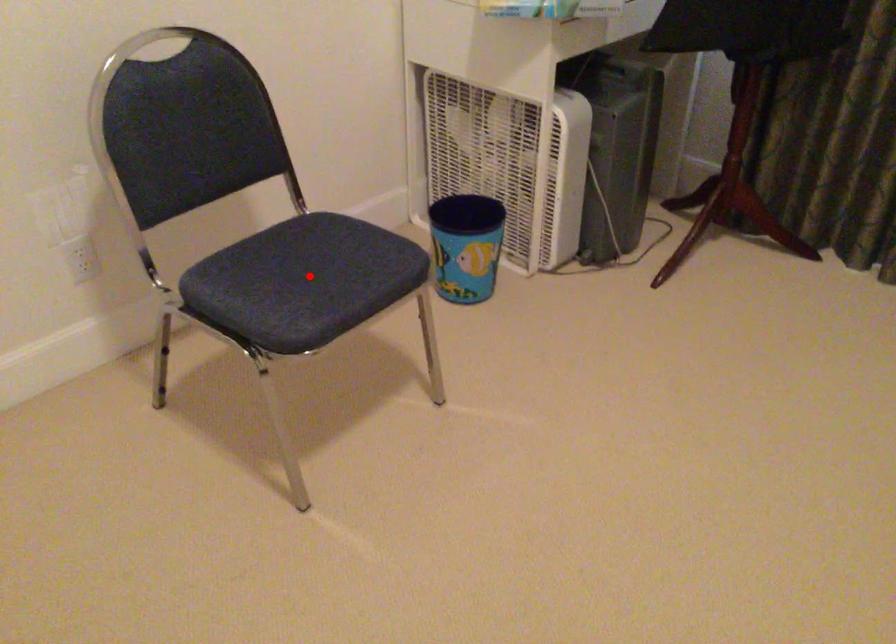
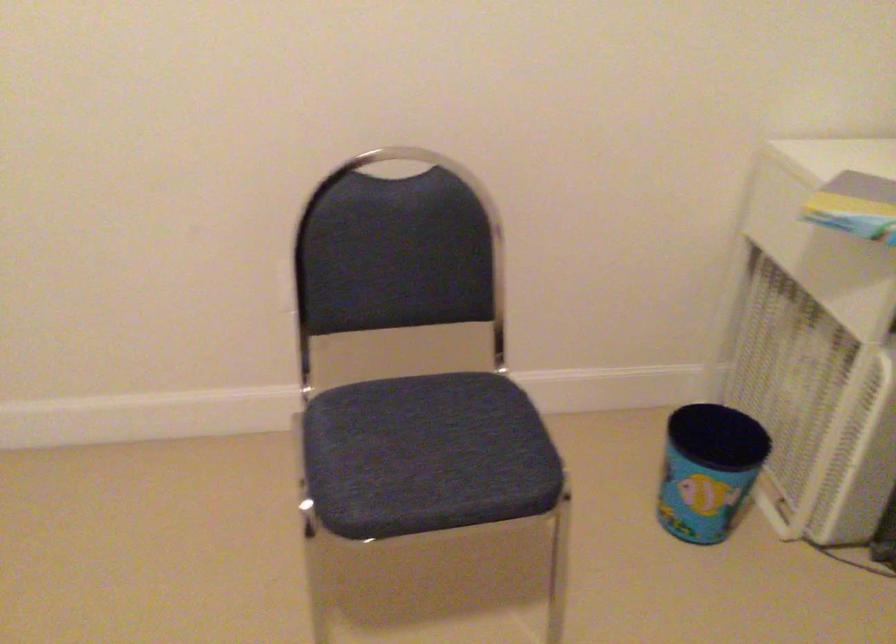
Question: I am providing you with two images of the same scene from different viewpoints. In image1, a red point is highlighted. Considering the same 3D point in image2, which of the following is correct?

Choices:
 (A) It is closer
 (B) It is farther

Answer: (A)